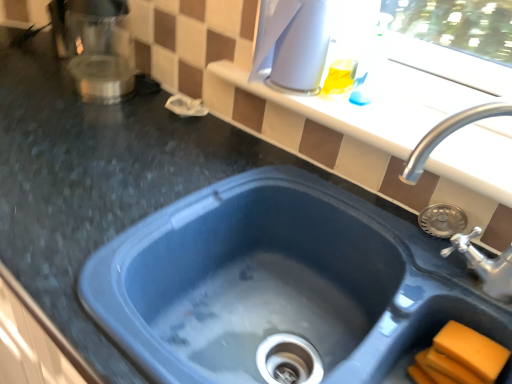
Question: From the image's perspective, does satin silver coffee maker at upper left, which is the second appliance in right-to-left order, appear lower than blue plastic sink at upper right, which appears as the 2th sink when viewed from the left?

Choices:
 (A) no
 (B) yes

Answer: (A)

Question: Can you confirm if satin silver coffee maker at upper left, which is the first appliance from left to right, is wider than blue plastic sink at upper right, which appears as the 2th sink when viewed from the left?

Choices:
 (A) yes
 (B) no

Answer: (A)

Question: Are satin silver coffee maker at upper left, which is the second appliance in right-to-left order, and blue plastic sink at upper right, positioned as the first sink in right-to-left order, beside each other?

Choices:
 (A) no
 (B) yes

Answer: (A)

Question: Can you confirm if satin silver coffee maker at upper left, which is the first appliance from left to right, is smaller than blue plastic sink at upper right, positioned as the first sink in right-to-left order?

Choices:
 (A) no
 (B) yes

Answer: (B)

Question: From a real-world perspective, is satin silver coffee maker at upper left, which is the second appliance in right-to-left order, over blue plastic sink at upper right, positioned as the first sink in right-to-left order?

Choices:
 (A) no
 (B) yes

Answer: (A)

Question: Is satin silver coffee maker at upper left, which is the second appliance in right-to-left order, aimed at blue plastic sink at upper right, positioned as the first sink in right-to-left order?

Choices:
 (A) yes
 (B) no

Answer: (B)

Question: Is white glossy kettle at upper center, the 1th appliance from the right, turned away from orange sponge at lower right?

Choices:
 (A) yes
 (B) no

Answer: (B)

Question: Does white glossy kettle at upper center, the 1th appliance from the right, turn towards orange sponge at lower right?

Choices:
 (A) no
 (B) yes

Answer: (A)

Question: Does white glossy kettle at upper center, placed as the 2th appliance when sorted from left to right, have a larger size compared to orange sponge at lower right?

Choices:
 (A) no
 (B) yes

Answer: (B)

Question: Can orange sponge at lower right be found inside white glossy kettle at upper center, placed as the 2th appliance when sorted from left to right?

Choices:
 (A) yes
 (B) no

Answer: (B)

Question: Does white glossy kettle at upper center, the 1th appliance from the right, have a greater height compared to orange sponge at lower right?

Choices:
 (A) no
 (B) yes

Answer: (B)

Question: From a real-world perspective, is white glossy kettle at upper center, the 1th appliance from the right, beneath orange sponge at lower right?

Choices:
 (A) yes
 (B) no

Answer: (B)

Question: Is blue plastic sink at center, the 1th sink viewed from the left, oriented away from white glossy kettle at upper center, placed as the 2th appliance when sorted from left to right?

Choices:
 (A) no
 (B) yes

Answer: (A)